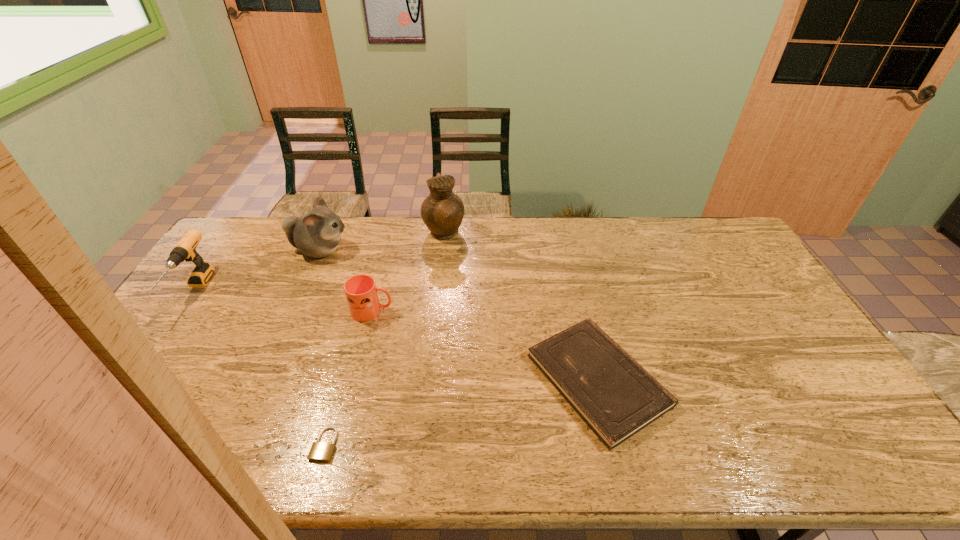
At what (x,y) coordinates should I click in order to perform the action: click on vacant space that satisfies the following two spatial constraints: 1. on the handle side of the second shortest object; 2. on the right side of the mug. Please return your answer as a coordinate pair (x, y). Image resolution: width=960 pixels, height=540 pixels. Looking at the image, I should click on (355, 380).

Locate an element on the screen. Image resolution: width=960 pixels, height=540 pixels. free space that satisfies the following two spatial constraints: 1. on the handle side of the leftmost object; 2. on the right side of the paperback book is located at coordinates [132, 380].

Locate an element on the screen. This screenshot has height=540, width=960. vacant space that satisfies the following two spatial constraints: 1. on the back side of the padlock; 2. on the face of the hamster is located at coordinates (378, 251).